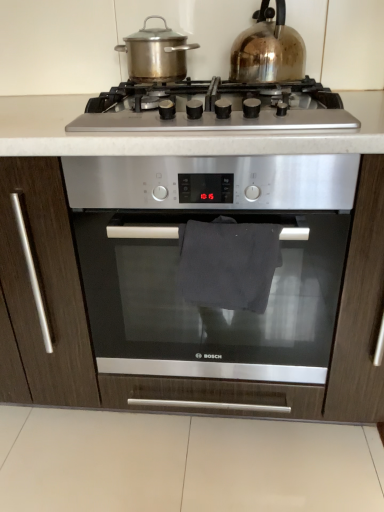
This screenshot has width=384, height=512. Describe the element at coordinates (214, 108) in the screenshot. I see `satin silver gas stove at center` at that location.

This screenshot has width=384, height=512. I want to click on satin silver oven at center, so pyautogui.click(x=179, y=260).

The width and height of the screenshot is (384, 512). Describe the element at coordinates (179, 260) in the screenshot. I see `satin silver oven at center` at that location.

Measure the distance between dark fabric towel at center and camera.

The distance of dark fabric towel at center from camera is 33.62 inches.

Identify the location of shiny metallic kettle at upper right, the 2th kitchen appliance when ordered from left to right. This screenshot has width=384, height=512. (268, 49).

Find the location of a particular element. This screenshot has width=384, height=512. satin silver gas stove at center is located at coordinates (214, 108).

Which point is more distant from viewer, (258, 17) or (222, 216)?

The point (258, 17) is behind.

Where is `material in front of the shiny metallic kettle at upper right, which is counted as the 1th kitchen appliance, starting from the right`? The height and width of the screenshot is (512, 384). material in front of the shiny metallic kettle at upper right, which is counted as the 1th kitchen appliance, starting from the right is located at coordinates click(x=228, y=263).

Visually, is shiny metallic kettle at upper right, the 2th kitchen appliance when ordered from left to right, positioned to the left or to the right of dark fabric towel at center?

Clearly, shiny metallic kettle at upper right, the 2th kitchen appliance when ordered from left to right, is on the right of dark fabric towel at center in the image.

Consider the image. From the image's perspective, which one is positioned lower, shiny metallic kettle at upper right, which is counted as the 1th kitchen appliance, starting from the right, or dark fabric towel at center?

dark fabric towel at center.

Is dark fabric towel at center situated inside shiny metallic kettle at upper right, which is counted as the 1th kitchen appliance, starting from the right, or outside?

dark fabric towel at center is not enclosed by shiny metallic kettle at upper right, which is counted as the 1th kitchen appliance, starting from the right.

How far apart are dark fabric towel at center and shiny metallic kettle at upper right, the 2th kitchen appliance when ordered from left to right?

19.49 inches.

In order to click on material that appears on the left of shiny metallic kettle at upper right, which is counted as the 1th kitchen appliance, starting from the right in this screenshot , I will do `click(228, 263)`.

From the image's perspective, which is below, dark fabric towel at center or shiny metallic kettle at upper right, which is counted as the 1th kitchen appliance, starting from the right?

From the image's view, dark fabric towel at center is below.

Does shiny metallic kettle at upper right, the 2th kitchen appliance when ordered from left to right, have a greater width compared to satin silver gas stove at center?

In fact, shiny metallic kettle at upper right, the 2th kitchen appliance when ordered from left to right, might be narrower than satin silver gas stove at center.

Can you confirm if shiny metallic kettle at upper right, the 2th kitchen appliance when ordered from left to right, is bigger than satin silver gas stove at center?

Actually, shiny metallic kettle at upper right, the 2th kitchen appliance when ordered from left to right, might be smaller than satin silver gas stove at center.

Based on their positions, is shiny metallic kettle at upper right, which is counted as the 1th kitchen appliance, starting from the right, located to the left or right of satin silver gas stove at center?

Clearly, shiny metallic kettle at upper right, which is counted as the 1th kitchen appliance, starting from the right, is on the right of satin silver gas stove at center in the image.

Identify the location of kitchen appliance on the right of satin silver gas stove at center. (268, 49).

In terms of width, does satin silver gas stove at center look wider or thinner when compared to stainless steel pot at upper center, placed as the first kitchen appliance when sorted from left to right?

Considering their sizes, satin silver gas stove at center looks broader than stainless steel pot at upper center, placed as the first kitchen appliance when sorted from left to right.

Consider the image. From the image's perspective, relative to stainless steel pot at upper center, placed as the first kitchen appliance when sorted from left to right, is satin silver gas stove at center above or below?

Based on their image positions, satin silver gas stove at center is located beneath stainless steel pot at upper center, placed as the first kitchen appliance when sorted from left to right.

Does satin silver gas stove at center contain stainless steel pot at upper center, placed as the first kitchen appliance when sorted from left to right?

No, satin silver gas stove at center does not contain stainless steel pot at upper center, placed as the first kitchen appliance when sorted from left to right.

Where is `gas stove beneath the stainless steel pot at upper center, which is counted as the second kitchen appliance, starting from the right (from a real-world perspective)`? The image size is (384, 512). gas stove beneath the stainless steel pot at upper center, which is counted as the second kitchen appliance, starting from the right (from a real-world perspective) is located at coordinates (214, 108).

Which is more distant, (135, 365) or (209, 279)?

Positioned behind is point (135, 365).

Looking at their sizes, would you say satin silver oven at center is wider or thinner than dark fabric towel at center?

Clearly, satin silver oven at center has more width compared to dark fabric towel at center.

What's the angular difference between satin silver oven at center and dark fabric towel at center's facing directions?

There is a 7.67-degree angle between the facing directions of satin silver oven at center and dark fabric towel at center.

Which of these two, satin silver oven at center or dark fabric towel at center, stands taller?

Standing taller between the two is satin silver oven at center.

Which of these two, stainless steel pot at upper center, which is counted as the second kitchen appliance, starting from the right, or shiny metallic kettle at upper right, the 2th kitchen appliance when ordered from left to right, stands taller?

shiny metallic kettle at upper right, the 2th kitchen appliance when ordered from left to right.

Considering the sizes of objects stainless steel pot at upper center, which is counted as the second kitchen appliance, starting from the right, and shiny metallic kettle at upper right, which is counted as the 1th kitchen appliance, starting from the right, in the image provided, who is thinner, stainless steel pot at upper center, which is counted as the second kitchen appliance, starting from the right, or shiny metallic kettle at upper right, which is counted as the 1th kitchen appliance, starting from the right,?

stainless steel pot at upper center, which is counted as the second kitchen appliance, starting from the right.

From the image's perspective, is stainless steel pot at upper center, which is counted as the second kitchen appliance, starting from the right, above or below shiny metallic kettle at upper right, the 2th kitchen appliance when ordered from left to right?

stainless steel pot at upper center, which is counted as the second kitchen appliance, starting from the right, is below shiny metallic kettle at upper right, the 2th kitchen appliance when ordered from left to right.

Can we say stainless steel pot at upper center, which is counted as the second kitchen appliance, starting from the right, lies outside shiny metallic kettle at upper right, which is counted as the 1th kitchen appliance, starting from the right?

Indeed, stainless steel pot at upper center, which is counted as the second kitchen appliance, starting from the right, is completely outside shiny metallic kettle at upper right, which is counted as the 1th kitchen appliance, starting from the right.

Is the surface of stainless steel pot at upper center, which is counted as the second kitchen appliance, starting from the right, in direct contact with satin silver oven at center?

No, stainless steel pot at upper center, which is counted as the second kitchen appliance, starting from the right, is not touching satin silver oven at center.

From the image's perspective, which one is positioned lower, stainless steel pot at upper center, placed as the first kitchen appliance when sorted from left to right, or satin silver oven at center?

satin silver oven at center, from the image's perspective.

Could you tell me if stainless steel pot at upper center, which is counted as the second kitchen appliance, starting from the right, is turned towards satin silver oven at center?

No, stainless steel pot at upper center, which is counted as the second kitchen appliance, starting from the right, is not turned towards satin silver oven at center.

Find the location of a particular element. material that is on the left side of shiny metallic kettle at upper right, the 2th kitchen appliance when ordered from left to right is located at coordinates (228, 263).

This screenshot has width=384, height=512. I want to click on material in front of the shiny metallic kettle at upper right, the 2th kitchen appliance when ordered from left to right, so click(x=228, y=263).

From the image, which object appears to be nearer to dark fabric towel at center, satin silver oven at center or stainless steel pot at upper center, placed as the first kitchen appliance when sorted from left to right?

Among the two, satin silver oven at center is located nearer to dark fabric towel at center.

Considering their positions, is shiny metallic kettle at upper right, which is counted as the 1th kitchen appliance, starting from the right, positioned further to dark fabric towel at center than satin silver gas stove at center?

Based on the image, shiny metallic kettle at upper right, which is counted as the 1th kitchen appliance, starting from the right, appears to be further to dark fabric towel at center.

Consider the image. Based on their spatial positions, is shiny metallic kettle at upper right, which is counted as the 1th kitchen appliance, starting from the right, or satin silver oven at center further from stainless steel pot at upper center, placed as the first kitchen appliance when sorted from left to right?

satin silver oven at center lies further to stainless steel pot at upper center, placed as the first kitchen appliance when sorted from left to right, than the other object.

Looking at this image, which object lies further to the anchor point stainless steel pot at upper center, placed as the first kitchen appliance when sorted from left to right, dark fabric towel at center or shiny metallic kettle at upper right, the 2th kitchen appliance when ordered from left to right?

Based on the image, dark fabric towel at center appears to be further to stainless steel pot at upper center, placed as the first kitchen appliance when sorted from left to right.

Estimate the real-world distances between objects in this image. Which object is closer to stainless steel pot at upper center, which is counted as the second kitchen appliance, starting from the right, satin silver gas stove at center or shiny metallic kettle at upper right, which is counted as the 1th kitchen appliance, starting from the right?

Based on the image, shiny metallic kettle at upper right, which is counted as the 1th kitchen appliance, starting from the right, appears to be nearer to stainless steel pot at upper center, which is counted as the second kitchen appliance, starting from the right.

Based on their spatial positions, is satin silver gas stove at center or dark fabric towel at center closer to satin silver oven at center?

dark fabric towel at center lies closer to satin silver oven at center than the other object.

When comparing their distances from shiny metallic kettle at upper right, the 2th kitchen appliance when ordered from left to right, does satin silver oven at center or dark fabric towel at center seem closer?

Among the two, dark fabric towel at center is located nearer to shiny metallic kettle at upper right, the 2th kitchen appliance when ordered from left to right.

Based on their spatial positions, is stainless steel pot at upper center, placed as the first kitchen appliance when sorted from left to right, or satin silver gas stove at center closer to satin silver oven at center?

satin silver gas stove at center is positioned closer to the anchor satin silver oven at center.

Find the location of a particular element. oven that lies between stainless steel pot at upper center, placed as the first kitchen appliance when sorted from left to right, and dark fabric towel at center from top to bottom is located at coordinates (179, 260).

The height and width of the screenshot is (512, 384). I want to click on kitchen appliance between shiny metallic kettle at upper right, which is counted as the 1th kitchen appliance, starting from the right, and dark fabric towel at center in the up-down direction, so click(x=156, y=53).

The height and width of the screenshot is (512, 384). I want to click on gas stove between stainless steel pot at upper center, which is counted as the second kitchen appliance, starting from the right, and dark fabric towel at center, in the vertical direction, so click(214, 108).

This screenshot has width=384, height=512. In order to click on gas stove between shiny metallic kettle at upper right, the 2th kitchen appliance when ordered from left to right, and satin silver oven at center, in the vertical direction in this screenshot , I will do `click(214, 108)`.